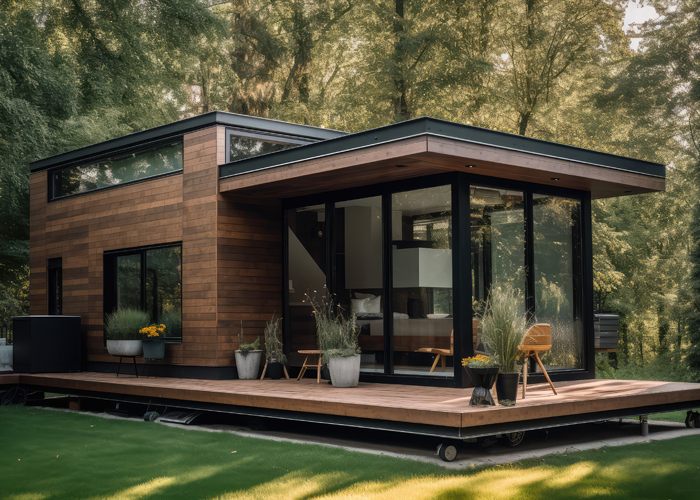
Where is `chair`? Image resolution: width=700 pixels, height=500 pixels. chair is located at coordinates pos(544,347), pos(444,352), pos(313,350).